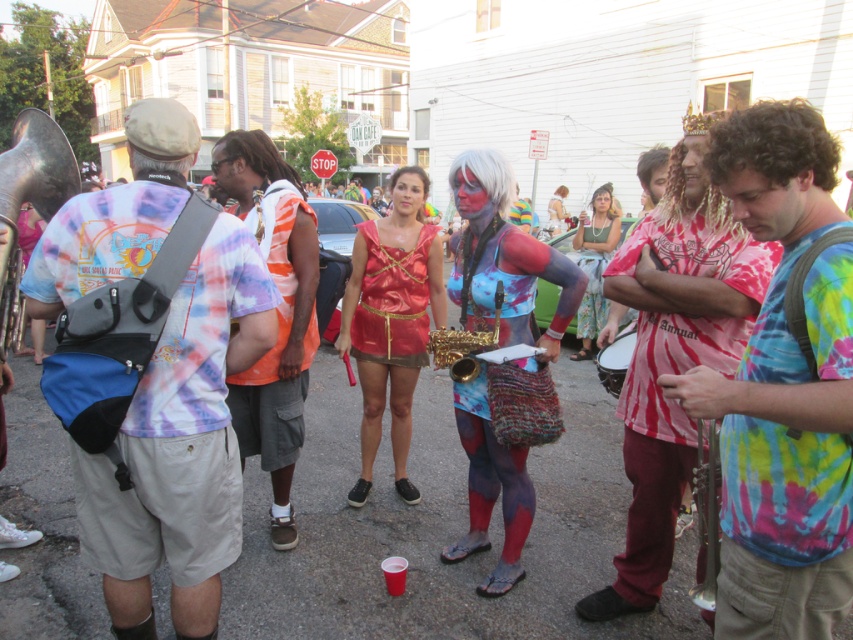
Based on the scene description, which object is taller between the shiny red fabric dress at center and the matte drum at center?

The shiny red fabric dress at center is taller than the matte drum at center according to the description.

In the festive street scene, there is a shiny red fabric dress at center and a matte drum at center. Which object is positioned higher from the ground?

The shiny red fabric dress at center is above the matte drum at center, so it is positioned higher from the ground.